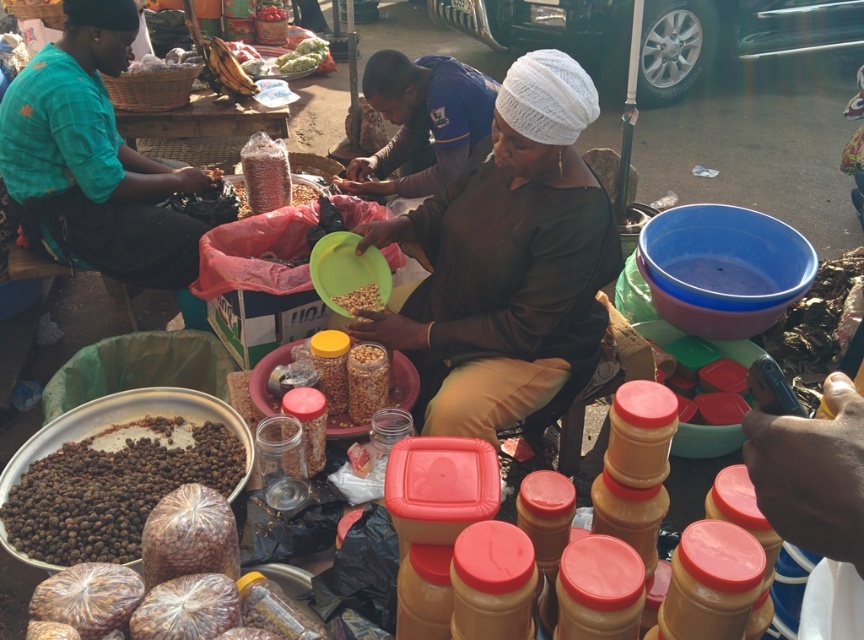
Is dark brown matte seeds at lower left below green leafy vegetables at center?

Correct, dark brown matte seeds at lower left is located below green leafy vegetables at center.

Between dark brown matte seeds at lower left and green leafy vegetables at center, which one appears on the right side from the viewer's perspective?

Positioned to the right is dark brown matte seeds at lower left.

Which is in front, point (5, 522) or point (303, 36)?

Point (5, 522) is in front.

Where is `dark brown matte seeds at lower left`? Image resolution: width=864 pixels, height=640 pixels. dark brown matte seeds at lower left is located at coordinates (110, 493).

Which is more to the left, dark brown matte seeds at lower left or brown matte grains at center?

From the viewer's perspective, dark brown matte seeds at lower left appears more on the left side.

Does dark brown matte seeds at lower left have a larger size compared to brown matte grains at center?

Correct, dark brown matte seeds at lower left is larger in size than brown matte grains at center.

I want to click on dark brown matte seeds at lower left, so click(x=110, y=493).

This screenshot has height=640, width=864. What are the coordinates of `dark brown matte seeds at lower left` in the screenshot? It's located at (110, 493).

From the picture: Between matte brown blouse at center and green leafy vegetables at center, which one is positioned higher?

green leafy vegetables at center is above.

Measure the distance between matte brown blouse at center and camera.

→ 6.35 feet

Identify the location of matte brown blouse at center. The image size is (864, 640). (507, 262).